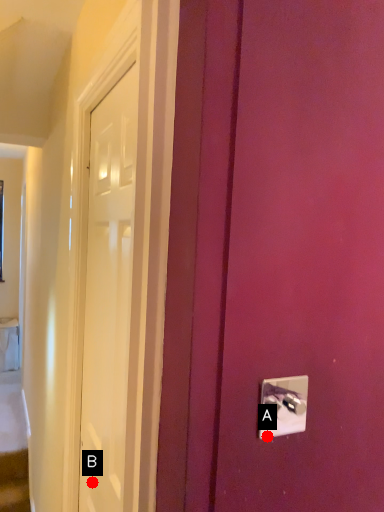
Question: Two points are circled on the image, labeled by A and B beside each circle. Which point is further to the camera?

Choices:
 (A) A is further
 (B) B is further

Answer: (B)